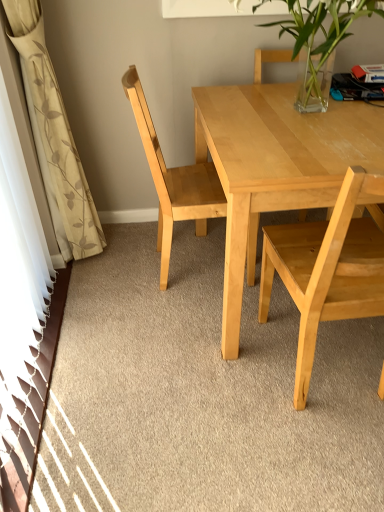
Question: Considering the positions of light wood chair at right, marked as the 1th chair in a right-to-left arrangement, and light wood chair at center, the first chair from the left, in the image, is light wood chair at right, marked as the 1th chair in a right-to-left arrangement, bigger or smaller than light wood chair at center, the first chair from the left,?

Choices:
 (A) big
 (B) small

Answer: (A)

Question: From the image's perspective, relative to light wood chair at center, the first chair from the left, is light wood chair at right, which appears as the second chair when viewed from the left, above or below?

Choices:
 (A) above
 (B) below

Answer: (B)

Question: Considering the real-world distances, which object is closest to the light wood chair at center, the first chair from the left?

Choices:
 (A) clear glass vase at upper center
 (B) light wood table at center
 (C) light wood chair at right, marked as the 1th chair in a right-to-left arrangement
 (D) white floral fabric curtain at left

Answer: (B)

Question: Which of these objects is positioned closest to the light wood table at center?

Choices:
 (A) light wood chair at center, placed as the 2th chair when sorted from right to left
 (B) light wood chair at right, marked as the 1th chair in a right-to-left arrangement
 (C) clear glass vase at upper center
 (D) white floral fabric curtain at left

Answer: (B)